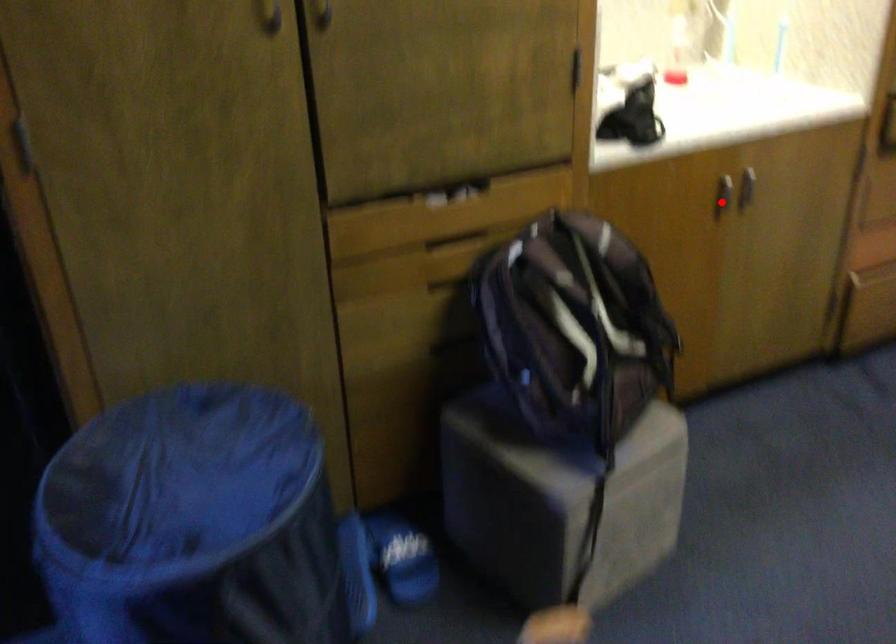
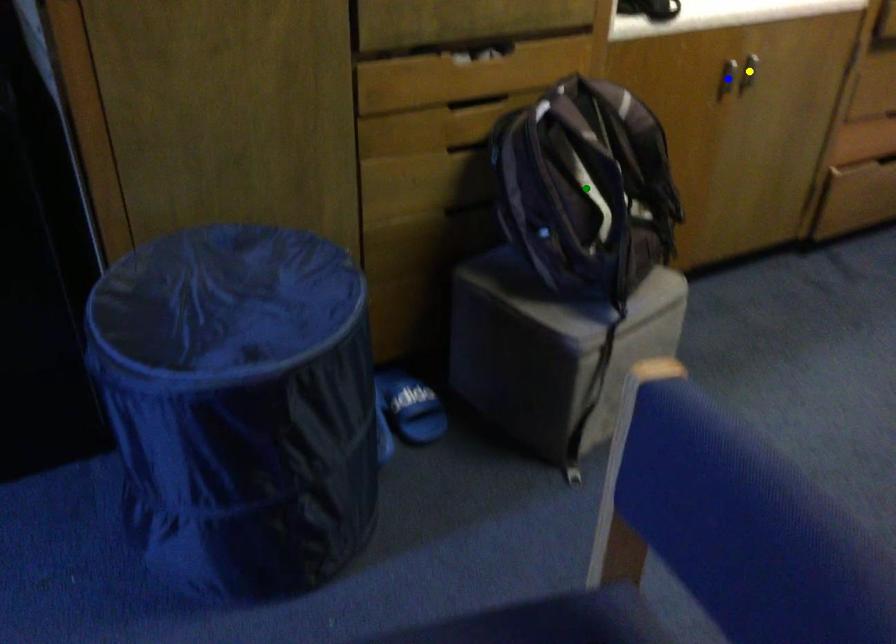
Question: I am providing you with two images of the same scene from different viewpoints. A red point is marked on the first image. You are given multiple points on the second image. In image 2, which mark is for the same physical point as the one in image 1?

Choices:
 (A) blue point
 (B) yellow point
 (C) green point

Answer: (A)